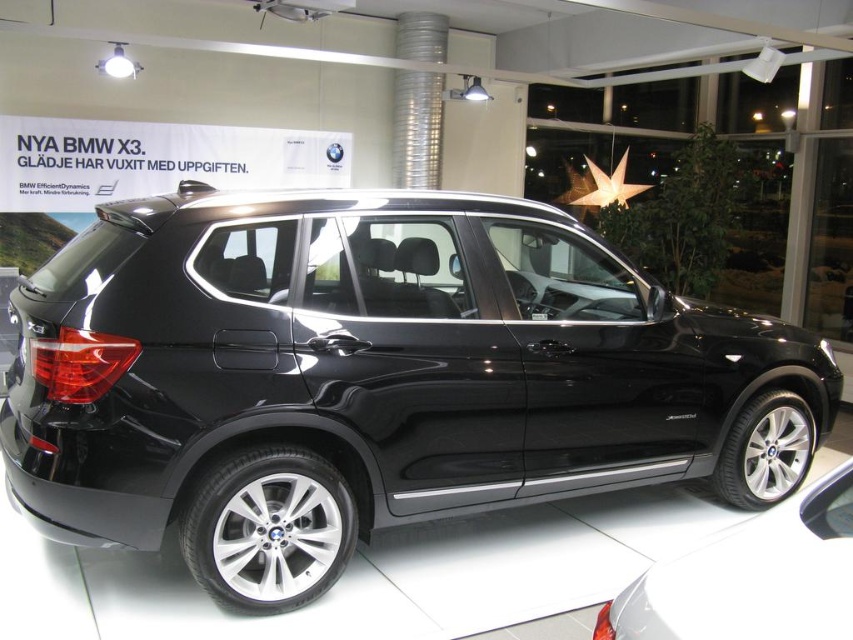
What is the relationship between the size of the glossy black suv at center and the black metallic car at lower right?

The glossy black suv at center is larger in size than the black metallic car at lower right.

In the scene shown: You are a delivery person who needs to park a 6.5 feet wide delivery van between the glossy black suv at center and the black metallic car at lower right. Is there enough space for the van to fit between them?

The glossy black suv at center is 5.92 feet away from the black metallic car at lower right. Since the distance between them is less than the 6.5 feet width of the delivery van, there is not enough space for the van to fit between them.